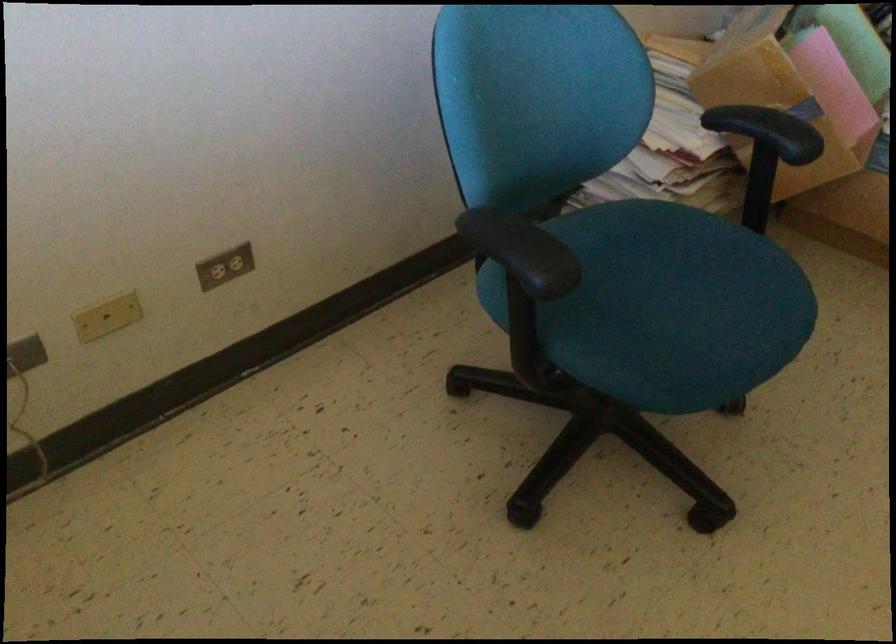
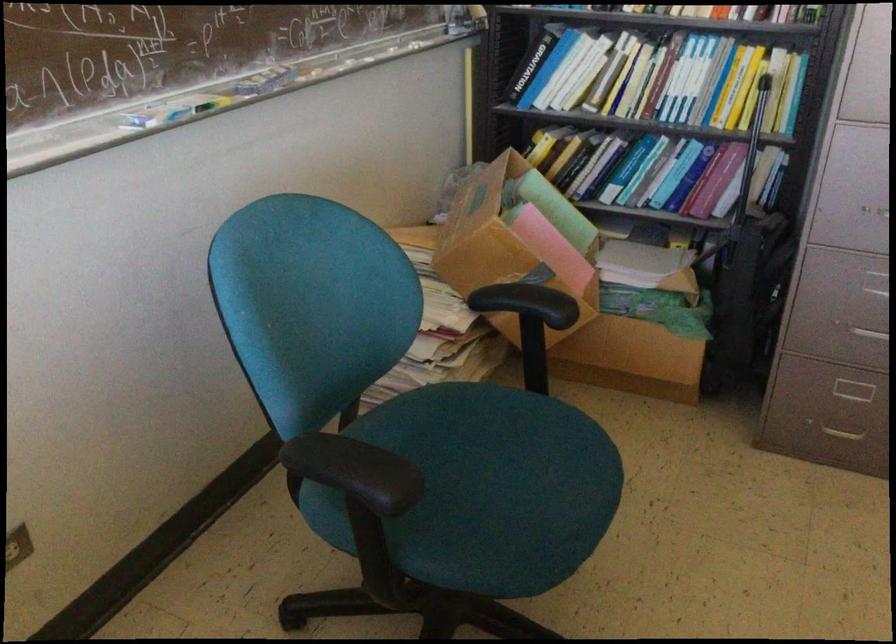
Question: In a continuous first-person perspective shot, in which direction is the camera moving?

Choices:
 (A) Left
 (B) Right
 (C) Forward
 (D) Backward

Answer: (A)